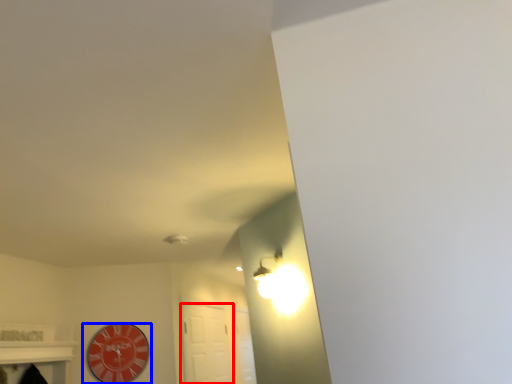
Question: Among these objects, which one is nearest to the camera, door (highlighted by a red box) or wall clock (highlighted by a blue box)?

Choices:
 (A) door
 (B) wall clock

Answer: (B)